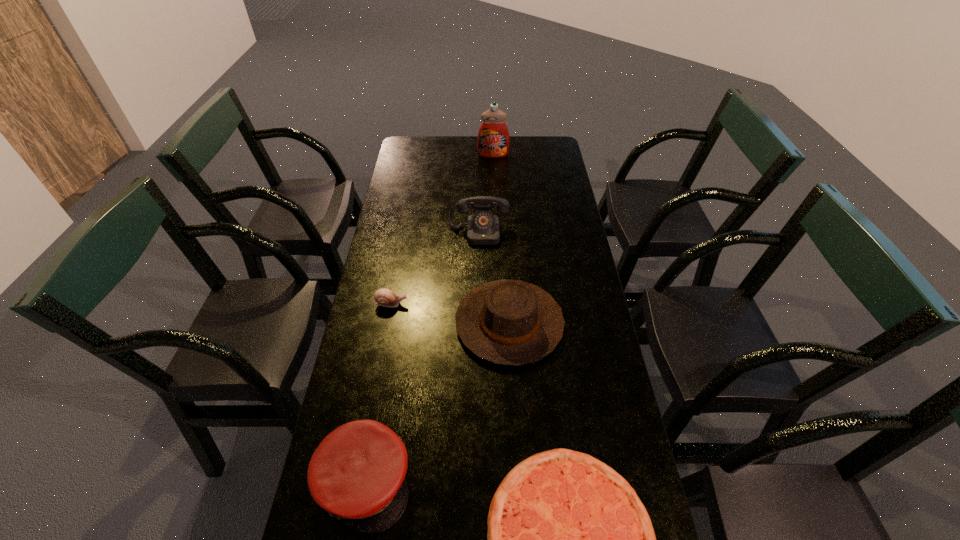
You are a GUI agent. You are given a task and a screenshot of the screen. Output one action in this format:
    pyautogui.click(x=<x>, y=<y>)
    Task: Click on the vacant space situated 0.100m on the front-facing side of the fifth tallest object
    This screenshot has width=960, height=540.
    Given the screenshot: What is the action you would take?
    pyautogui.click(x=440, y=303)

This screenshot has width=960, height=540. In order to click on object positioned at the far edge in this screenshot , I will do click(x=493, y=137).

Image resolution: width=960 pixels, height=540 pixels. What are the coordinates of `cap situated at the left edge` in the screenshot? It's located at (357, 472).

Locate an element on the screen. This screenshot has width=960, height=540. escargot at the left edge is located at coordinates (384, 297).

I want to click on object present at the right edge, so click(x=506, y=322).

You are a GUI agent. You are given a task and a screenshot of the screen. Output one action in this format:
    pyautogui.click(x=<x>, y=<y>)
    Task: Click on the vacant space at the far edge of the desktop
    The image size is (960, 540).
    Given the screenshot: What is the action you would take?
    pyautogui.click(x=457, y=159)

Locate an element on the screen. This screenshot has width=960, height=540. free spot at the left edge of the desktop is located at coordinates (367, 305).

The image size is (960, 540). Identify the location of vacant space at the right edge. tap(551, 296).

Where is `vacant space at the far left corner of the desktop`? vacant space at the far left corner of the desktop is located at coordinates (412, 152).

Locate an element on the screen. vacant space at the far right corner of the desktop is located at coordinates (537, 147).